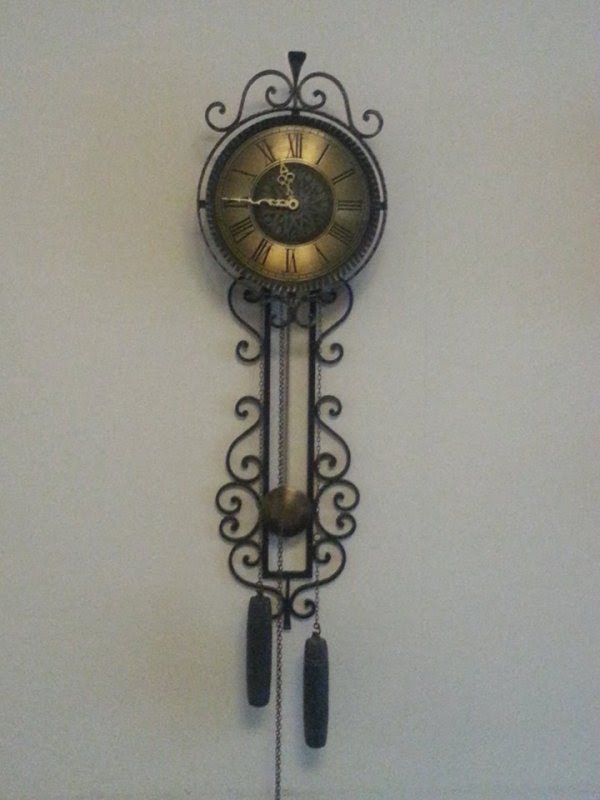
The width and height of the screenshot is (600, 800). In order to click on clock face in this screenshot , I will do `click(291, 205)`.